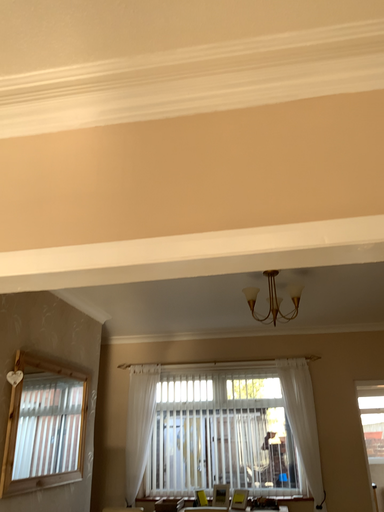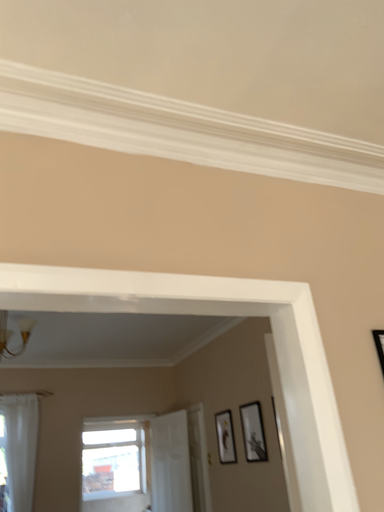
Question: How did the camera likely rotate when shooting the video?

Choices:
 (A) rotated right
 (B) rotated left

Answer: (A)